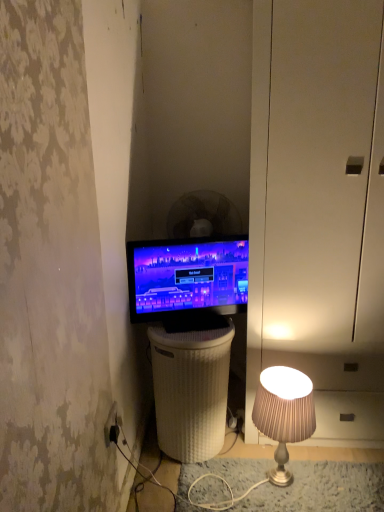
The height and width of the screenshot is (512, 384). Describe the element at coordinates (319, 209) in the screenshot. I see `white glossy dresser at right` at that location.

Locate an element on the screen. Image resolution: width=384 pixels, height=512 pixels. white glossy dresser at right is located at coordinates (319, 209).

This screenshot has width=384, height=512. I want to click on black plastic mechanical fan at center, so click(x=203, y=216).

Describe the element at coordinates (203, 216) in the screenshot. Image resolution: width=384 pixels, height=512 pixels. I see `black plastic mechanical fan at center` at that location.

Where is `white glossy dresser at right`? The image size is (384, 512). white glossy dresser at right is located at coordinates (319, 209).

Which is more to the left, black plastic mechanical fan at center or white glossy dresser at right?

Positioned to the left is black plastic mechanical fan at center.

Which object is more forward, black plastic mechanical fan at center or white glossy dresser at right?

Positioned in front is white glossy dresser at right.

Does point (215, 224) come closer to viewer compared to point (323, 231)?

No, (215, 224) is behind (323, 231).

From the image's perspective, is black plastic mechanical fan at center located above white glossy dresser at right?

Correct, black plastic mechanical fan at center appears higher than white glossy dresser at right in the image.

From a real-world perspective, between black plastic mechanical fan at center and white glossy dresser at right, who is vertically higher?

black plastic mechanical fan at center, from a real-world perspective.

Consider the image. Considering the relative sizes of black plastic mechanical fan at center and white glossy dresser at right in the image provided, is black plastic mechanical fan at center wider than white glossy dresser at right?

No, black plastic mechanical fan at center is not wider than white glossy dresser at right.

From their relative heights in the image, would you say black plastic mechanical fan at center is taller or shorter than white glossy dresser at right?

black plastic mechanical fan at center is shorter than white glossy dresser at right.

Who is bigger, black plastic mechanical fan at center or white glossy dresser at right?

white glossy dresser at right is bigger.

Is black plastic mechanical fan at center inside or outside of white glossy dresser at right?

black plastic mechanical fan at center is spatially situated outside white glossy dresser at right.

Are black plastic mechanical fan at center and white glossy dresser at right making contact?

black plastic mechanical fan at center is not next to white glossy dresser at right, and they're not touching.

Based on the photo, is black plastic mechanical fan at center looking in the opposite direction of white glossy dresser at right?

No, black plastic mechanical fan at center's orientation is not away from white glossy dresser at right.

At what (x,y) coordinates should I click in order to perform the action: click on mechanical fan that appears behind the white glossy dresser at right. Please return your answer as a coordinate pair (x, y). This screenshot has height=512, width=384. Looking at the image, I should click on (203, 216).

Looking at this image, considering the relative positions of white glossy dresser at right and black plastic mechanical fan at center in the image provided, is white glossy dresser at right to the right of black plastic mechanical fan at center from the viewer's perspective?

Indeed, white glossy dresser at right is positioned on the right side of black plastic mechanical fan at center.

Which object is further away from the camera, white glossy dresser at right or black plastic mechanical fan at center?

black plastic mechanical fan at center is more distant.

Which is less distant, (296, 134) or (170, 227)?

Point (296, 134) is closer to the camera than point (170, 227).

Looking at this image, from the image's perspective, is white glossy dresser at right above or below black plastic mechanical fan at center?

white glossy dresser at right is situated lower than black plastic mechanical fan at center in the image.

From a real-world perspective, is white glossy dresser at right below black plastic mechanical fan at center?

Yes, from a real-world perspective, white glossy dresser at right is under black plastic mechanical fan at center.

Considering the sizes of objects white glossy dresser at right and black plastic mechanical fan at center in the image provided, who is thinner, white glossy dresser at right or black plastic mechanical fan at center?

black plastic mechanical fan at center.

Can you confirm if white glossy dresser at right is taller than black plastic mechanical fan at center?

Yes, white glossy dresser at right is taller than black plastic mechanical fan at center.

Is white glossy dresser at right bigger than black plastic mechanical fan at center?

Indeed, white glossy dresser at right has a larger size compared to black plastic mechanical fan at center.

Would you say black plastic mechanical fan at center is part of white glossy dresser at right's contents?

No, black plastic mechanical fan at center is not surrounded by white glossy dresser at right.

From the picture: Would you consider white glossy dresser at right to be distant from black plastic mechanical fan at center?

Actually, white glossy dresser at right and black plastic mechanical fan at center are a little close together.

Could you tell me if white glossy dresser at right is turned towards black plastic mechanical fan at center?

Yes, white glossy dresser at right is oriented towards black plastic mechanical fan at center.

What's the angular difference between white glossy dresser at right and black plastic mechanical fan at center's facing directions?

They differ by 163 degrees in their facing directions.

How much distance is there between white glossy dresser at right and black plastic mechanical fan at center?

23.30 inches.

Image resolution: width=384 pixels, height=512 pixels. There is a white glossy dresser at right. Identify the location of mechanical fan above it (from a real-world perspective). (203, 216).

Where is `mechanical fan behind the white glossy dresser at right`? The height and width of the screenshot is (512, 384). mechanical fan behind the white glossy dresser at right is located at coordinates pos(203,216).

Identify the location of dresser in front of the black plastic mechanical fan at center. The width and height of the screenshot is (384, 512). (319, 209).